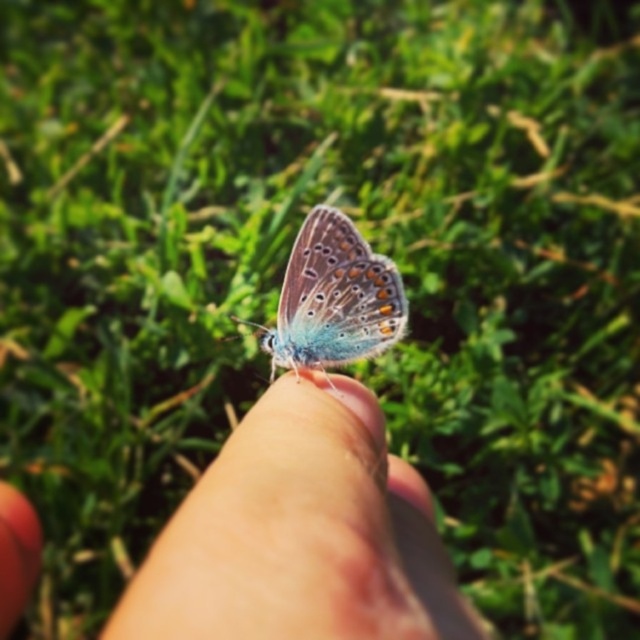
You are a photographer trying to capture a closeup of the translucent iridescent butterfly at center. You need to adjust your camera focus to ensure both the butterfly and the smooth skin finger at center are in focus. What is the minimum distance you should set your camera focus to achieve this?

The minimum focus distance should be set to 6.51 inches to ensure both the smooth skin finger at center and the translucent iridescent butterfly at center are in focus since they are 6.51 inches apart.

You are a photographer aiming to capture the butterfly on the finger in the image. To ensure both the butterfly and the finger are in focus, which one should you focus on first, the smooth skin finger at center or the translucent iridescent butterfly at center?

The smooth skin finger at center is located below the translucent iridescent butterfly at center. Since the finger is closer to the camera, focusing on it first will ensure both are in focus as the butterfly is further away.